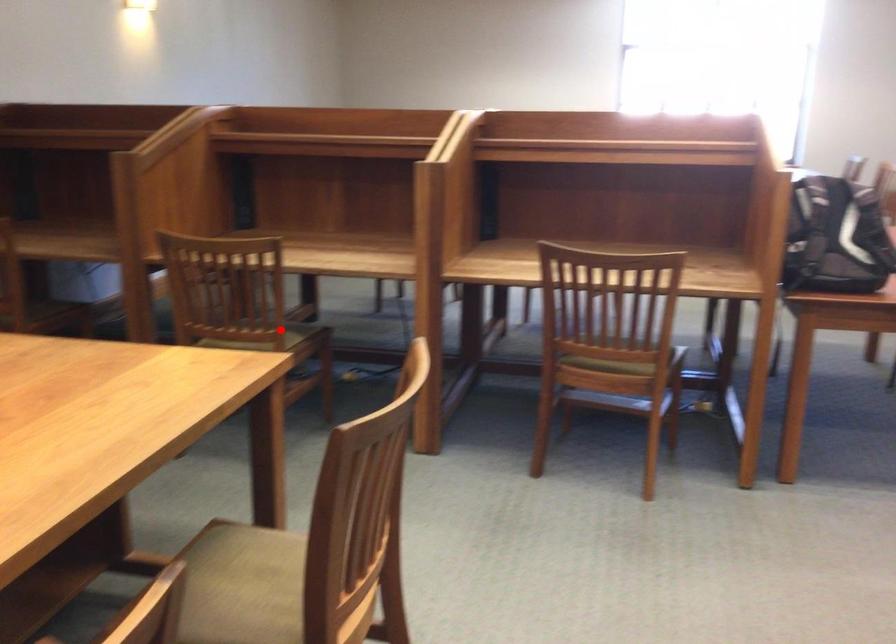
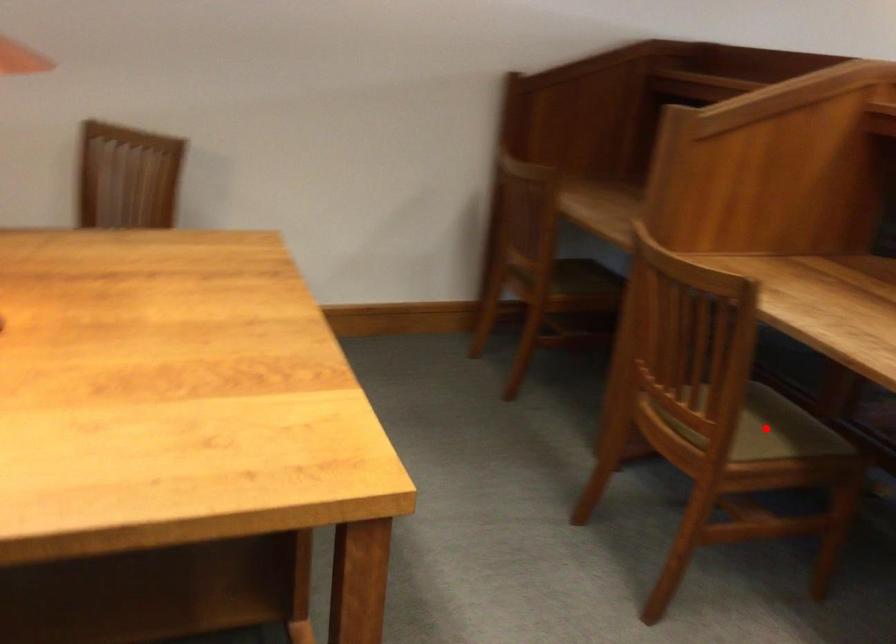
I am providing you with two images of the same scene from different viewpoints. A red point is marked on the first image and another point is marked on the second image. Is the marked point in image1 the same physical position as the marked point in image2?

Yes